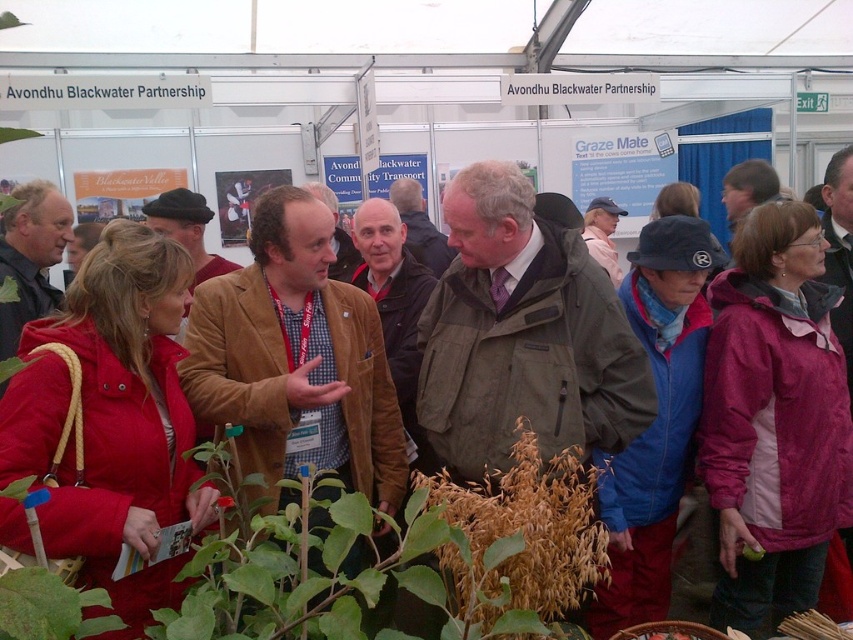
Is matte red jacket at lower left below brown textured plant at center?

Actually, matte red jacket at lower left is above brown textured plant at center.

Which is above, matte red jacket at lower left or brown textured plant at center?

Positioned higher is matte red jacket at lower left.

Between point (68, 534) and point (560, 525), which one is positioned in front?

Point (560, 525) is more forward.

Locate an element on the screen. The image size is (853, 640). matte red jacket at lower left is located at coordinates (111, 420).

Is pink fabric jacket at lower right positioned behind brown textured plant at center?

Yes, it is behind brown textured plant at center.

Is point (740, 612) farther from viewer compared to point (419, 609)?

No, it is in front of (419, 609).

This screenshot has height=640, width=853. Identify the location of pink fabric jacket at lower right. (775, 419).

Is brown textured plant at center below green leafy plant at lower left?

Incorrect, brown textured plant at center is not positioned below green leafy plant at lower left.

Which is below, brown textured plant at center or green leafy plant at lower left?

green leafy plant at lower left is below.

Who is more forward, (572,520) or (74,630)?

Point (74,630)

Locate an element on the screen. The height and width of the screenshot is (640, 853). brown textured plant at center is located at coordinates (523, 531).